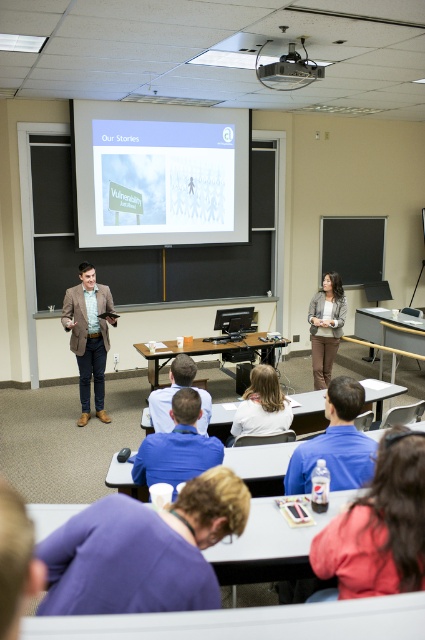
Who is shorter, white matte shirt at center or gray fabric jacket at center?

With less height is white matte shirt at center.

Can you confirm if white matte shirt at center is smaller than gray fabric jacket at center?

Yes.

Which is behind, point (249, 417) or point (316, 323)?

The point (316, 323) is more distant.

The image size is (425, 640). I want to click on white matte shirt at center, so click(x=261, y=406).

The image size is (425, 640). What do you see at coordinates (88, 336) in the screenshot? I see `brown leather jacket at center` at bounding box center [88, 336].

Which is in front, point (79, 339) or point (277, 412)?

Point (277, 412) is in front.

This screenshot has height=640, width=425. What do you see at coordinates (88, 336) in the screenshot?
I see `brown leather jacket at center` at bounding box center [88, 336].

Locate an element on the screen. This screenshot has height=640, width=425. brown leather jacket at center is located at coordinates (88, 336).

Describe the element at coordinates (142, 550) in the screenshot. The image size is (425, 640). I see `purple fabric shirt at lower center` at that location.

Between point (220, 486) and point (96, 316), which one is positioned behind?

The point (96, 316) is behind.

Locate an element on the screen. The image size is (425, 640). purple fabric shirt at lower center is located at coordinates (142, 550).